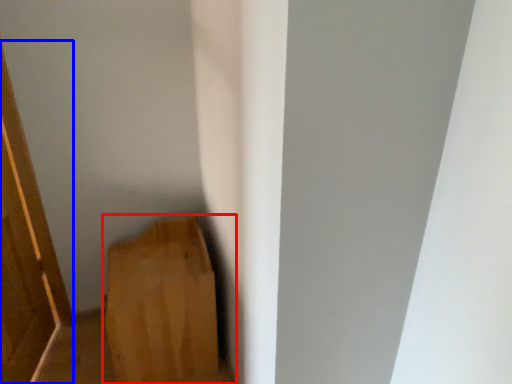
Question: Which object is closer to the camera taking this photo, furniture (highlighted by a red box) or door (highlighted by a blue box)?

Choices:
 (A) furniture
 (B) door

Answer: (B)